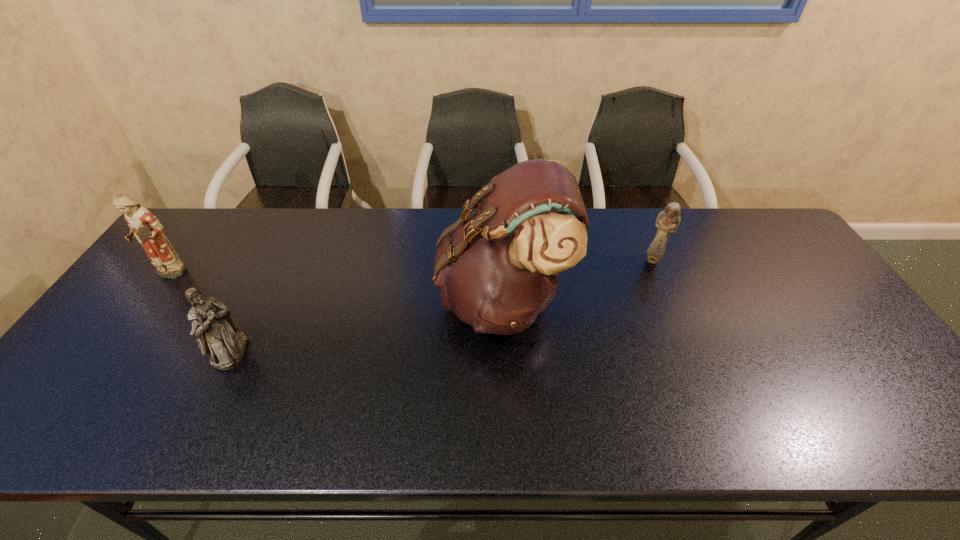
I want to click on free region at the far right corner of the desktop, so point(786,252).

In the image, there is a desktop. Identify the location of vacant space at the near right corner. (881, 421).

This screenshot has height=540, width=960. What are the coordinates of `blank region between the tallest figurine and the satchel` in the screenshot? It's located at pyautogui.click(x=335, y=288).

At what (x,y) coordinates should I click in order to perform the action: click on unoccupied position between the tallest object and the second object from left to right. Please return your answer as a coordinate pair (x, y). Looking at the image, I should click on (367, 326).

Find the location of a particular element. This screenshot has height=540, width=960. empty location between the nearest figurine and the satchel is located at coordinates (367, 326).

The width and height of the screenshot is (960, 540). I want to click on unoccupied position between the nearest figurine and the tallest object, so click(367, 326).

The height and width of the screenshot is (540, 960). I want to click on vacant space in between the nearest figurine and the second object from right to left, so click(x=367, y=326).

Where is `free space between the leftmost figurine and the rightmost figurine`? The image size is (960, 540). free space between the leftmost figurine and the rightmost figurine is located at coordinates (411, 268).

At what (x,y) coordinates should I click in order to perform the action: click on object that is the third closest to the rightmost object. Please return your answer as a coordinate pair (x, y). This screenshot has height=540, width=960. Looking at the image, I should click on (145, 227).

Locate an element on the screen. This screenshot has width=960, height=540. object that ranks as the second closest to the tallest object is located at coordinates (216, 332).